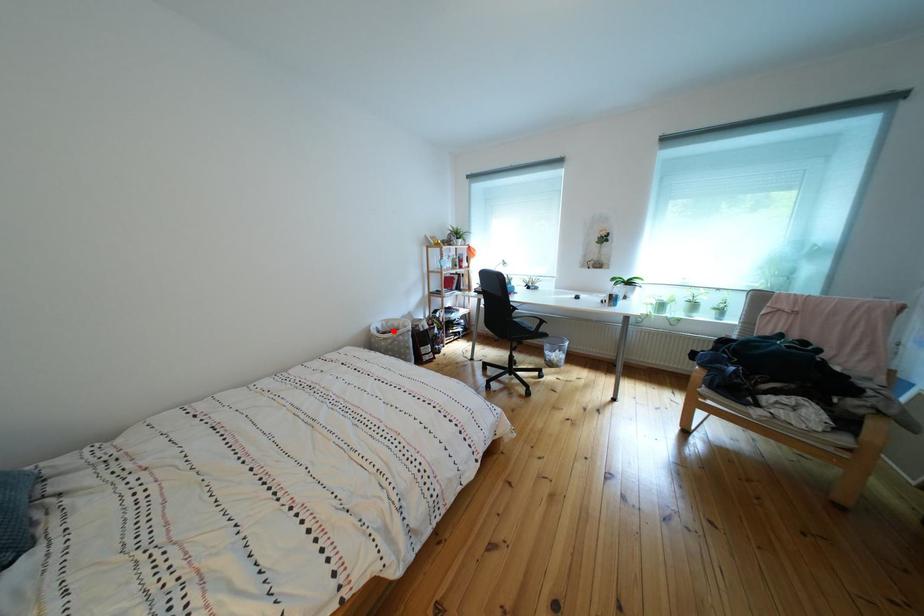
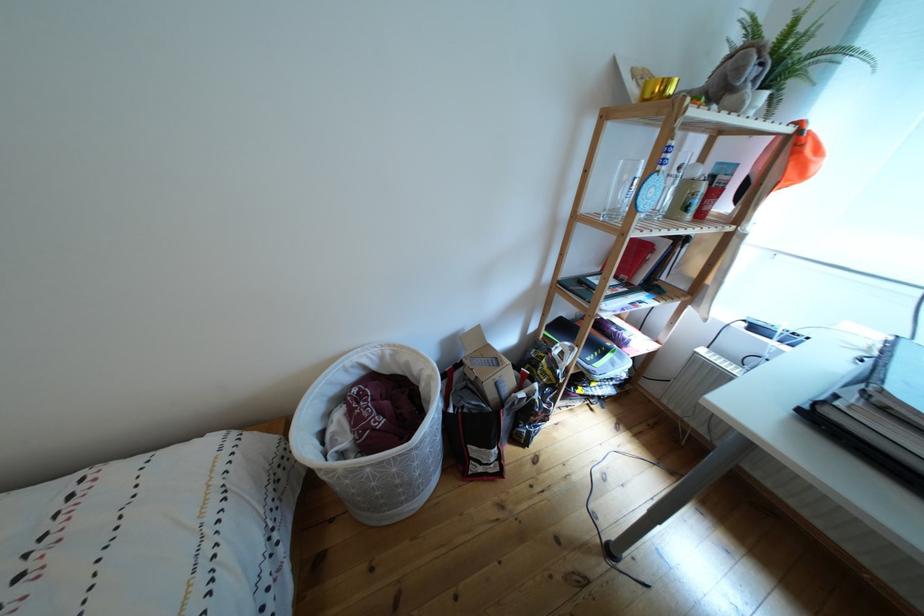
Where in the second image is the point corresponding to the highlighted location from the first image?

(393, 363)